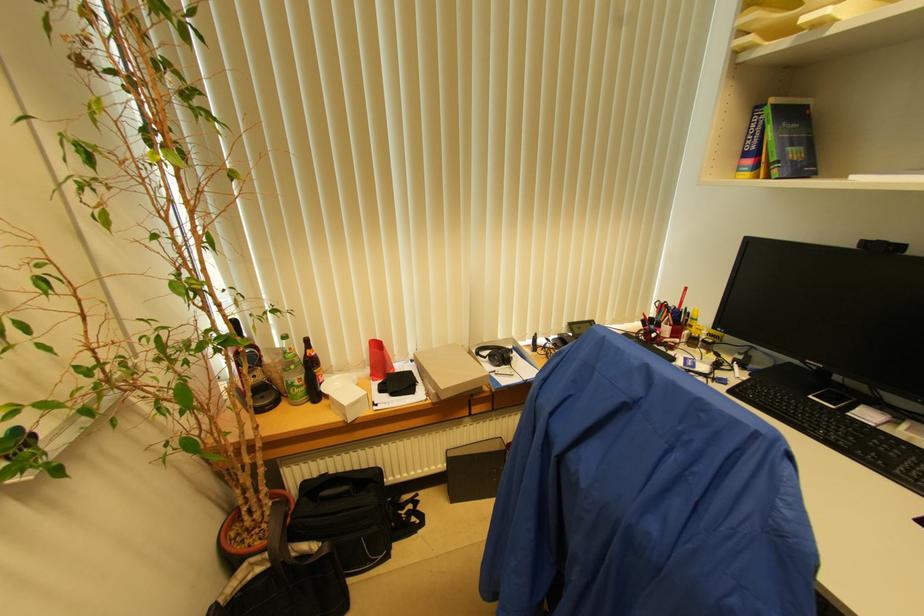
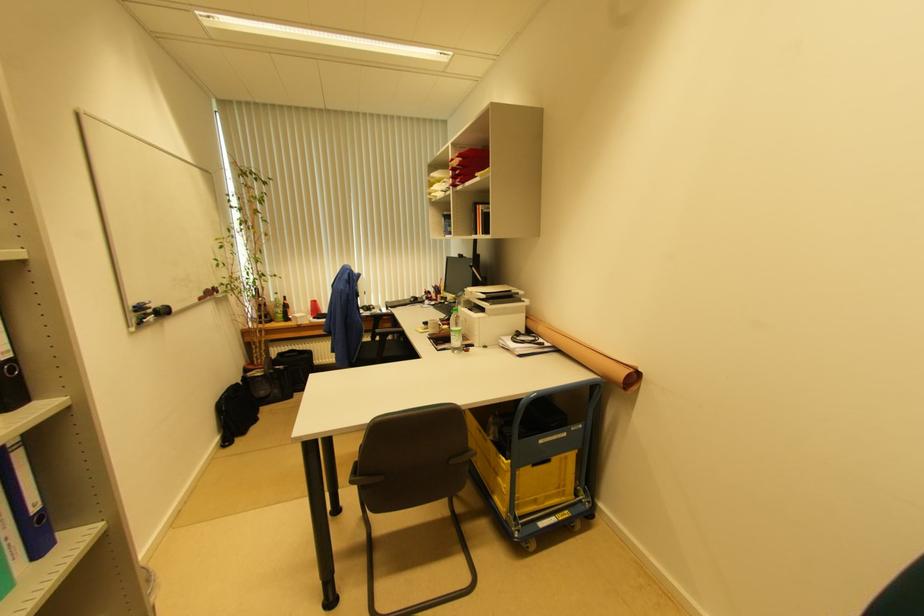
In the second image, find the point that corresponds to point 379,341 in the first image.

(315, 302)